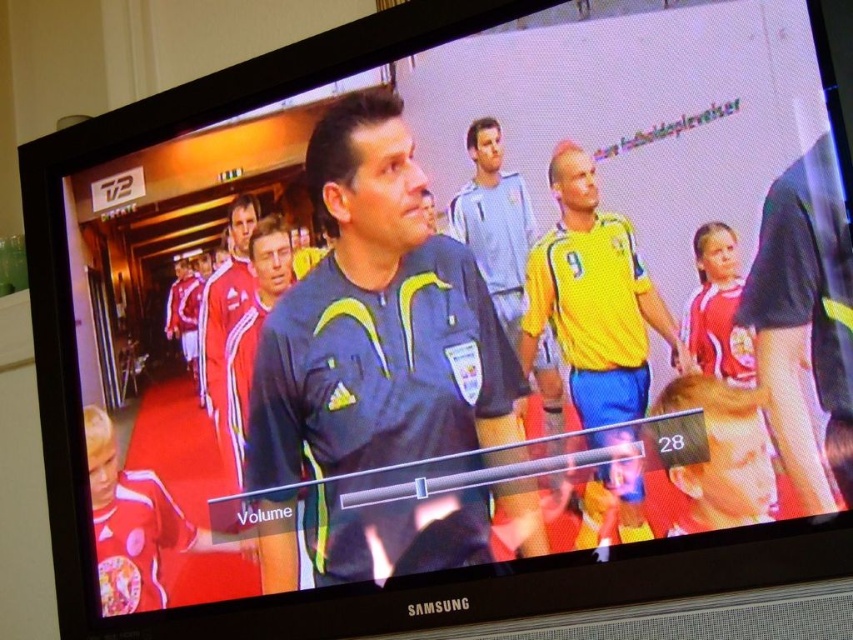
Question: Which of the following is the closest to the observer?

Choices:
 (A) yellow jersey at center
 (B) dark blue jersey at center

Answer: (A)

Question: Can you confirm if dark blue jersey at center is thinner than yellow jersey at center?

Choices:
 (A) no
 (B) yes

Answer: (A)

Question: Is dark blue jersey at center bigger than yellow jersey at center?

Choices:
 (A) yes
 (B) no

Answer: (A)

Question: Which point appears closest to the camera in this image?

Choices:
 (A) (581, 305)
 (B) (281, 371)

Answer: (A)

Question: Does dark blue jersey at center have a larger size compared to yellow jersey at center?

Choices:
 (A) no
 (B) yes

Answer: (B)